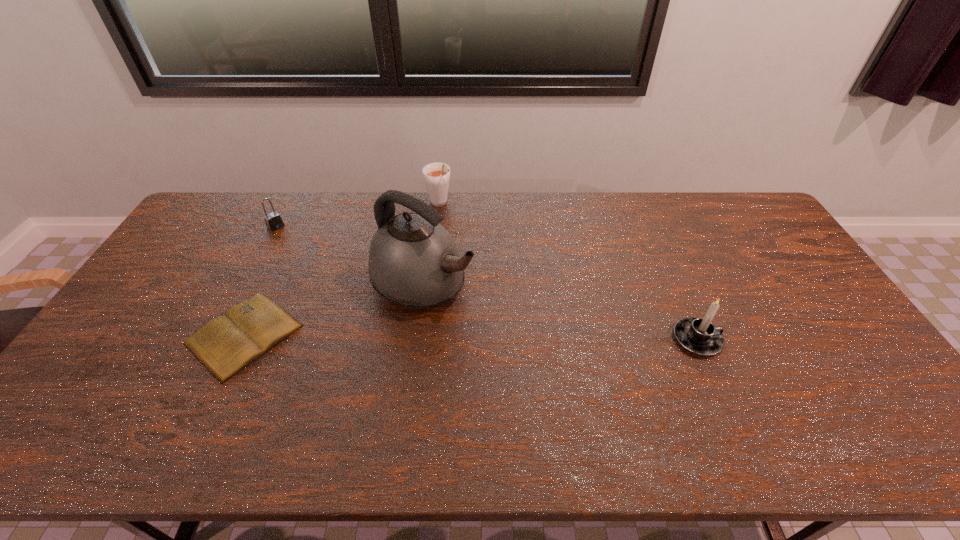
Image resolution: width=960 pixels, height=540 pixels. Identify the location of the shortest object. (225, 345).

Locate an element on the screen. The image size is (960, 540). candle holder is located at coordinates (699, 336).

Locate an element on the screen. This screenshot has width=960, height=540. the tallest object is located at coordinates (413, 261).

Where is `root beer`? root beer is located at coordinates (436, 175).

What are the coordinates of `padlock` in the screenshot? It's located at (273, 221).

This screenshot has width=960, height=540. Identify the location of the fourth tallest object. (273, 221).

This screenshot has height=540, width=960. Identify the location of free point located on the right of the shortest object. 380,335.

Find the location of a particular element. free space located with a handle on the side of the rightmost object is located at coordinates (768, 339).

You are a GUI agent. You are given a task and a screenshot of the screen. Output one action in this format:
    pyautogui.click(x=<x>, y=<y>)
    Task: Click on the free region located at the spout of the kettle
    The image size is (960, 540).
    Given the screenshot: What is the action you would take?
    pyautogui.click(x=576, y=360)

At what (x,y) coordinates should I click in order to perform the action: click on free space located at the spout of the kettle. Please return your answer as a coordinate pair (x, y). The width and height of the screenshot is (960, 540). Looking at the image, I should click on (527, 334).